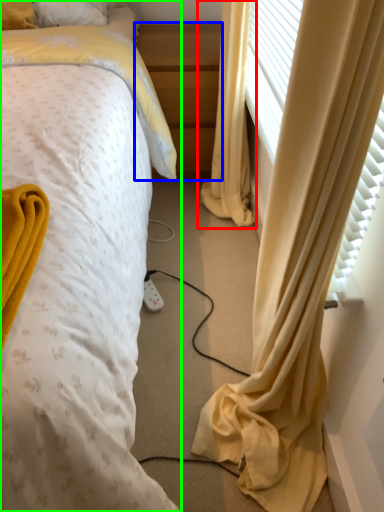
Question: Which is farther away from curtain (highlighted by a red box)? nightstand (highlighted by a blue box) or bed (highlighted by a green box)?

Choices:
 (A) nightstand
 (B) bed

Answer: (B)